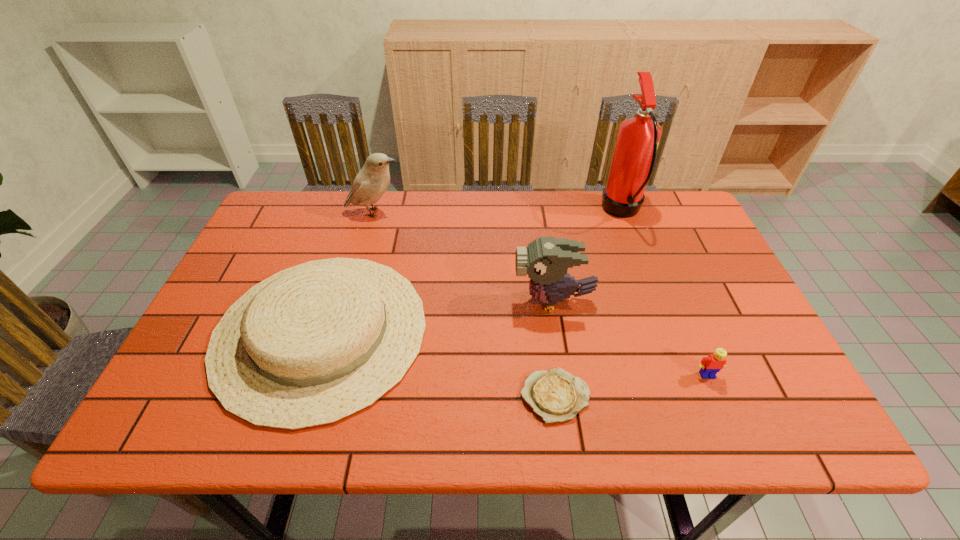
At what (x,y) coordinates should I click in order to perform the action: click on vacant space located 0.260m at the beak of the right bird. Please return your answer as a coordinate pair (x, y). Looking at the image, I should click on click(x=411, y=301).

This screenshot has height=540, width=960. I want to click on vacant area located at the beak of the right bird, so click(383, 301).

Image resolution: width=960 pixels, height=540 pixels. I want to click on free space located 0.250m at the beak of the right bird, so click(x=415, y=301).

At what (x,y) coordinates should I click in order to perform the action: click on free location located 0.320m on the back of the sunhat. Please return your answer as a coordinate pair (x, y). Image resolution: width=960 pixels, height=540 pixels. Looking at the image, I should click on (365, 194).

Where is `free spot located on the front-facing side of the Lego`? This screenshot has width=960, height=540. free spot located on the front-facing side of the Lego is located at coordinates (721, 409).

Image resolution: width=960 pixels, height=540 pixels. I want to click on vacant space located 0.100m on the right of the shortest object, so point(637,396).

Where is `fire extinguisher that is at the far edge`? The width and height of the screenshot is (960, 540). fire extinguisher that is at the far edge is located at coordinates (634, 156).

Find the location of a particular element. bird positioned at the far edge is located at coordinates (372, 181).

Locate an element on the screen. This screenshot has width=960, height=540. sunhat that is at the near edge is located at coordinates (313, 344).

Locate an element on the screen. The width and height of the screenshot is (960, 540). quiche that is at the near edge is located at coordinates (555, 395).